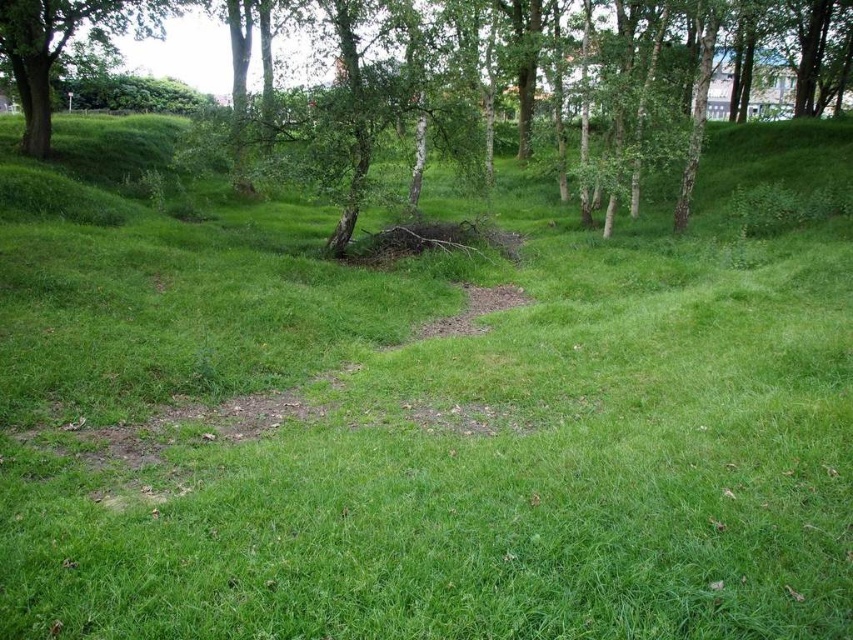
Which of these two, green leafy tree at upper center or green leafy tree at upper left, stands taller?

green leafy tree at upper center is taller.

From the picture: Between green leafy tree at upper center and green leafy tree at upper left, which one appears on the left side from the viewer's perspective?

From the viewer's perspective, green leafy tree at upper left appears more on the left side.

Is point (633, 1) behind point (27, 118)?

No, (633, 1) is closer to viewer.

Locate an element on the screen. The image size is (853, 640). green leafy tree at upper center is located at coordinates click(x=366, y=99).